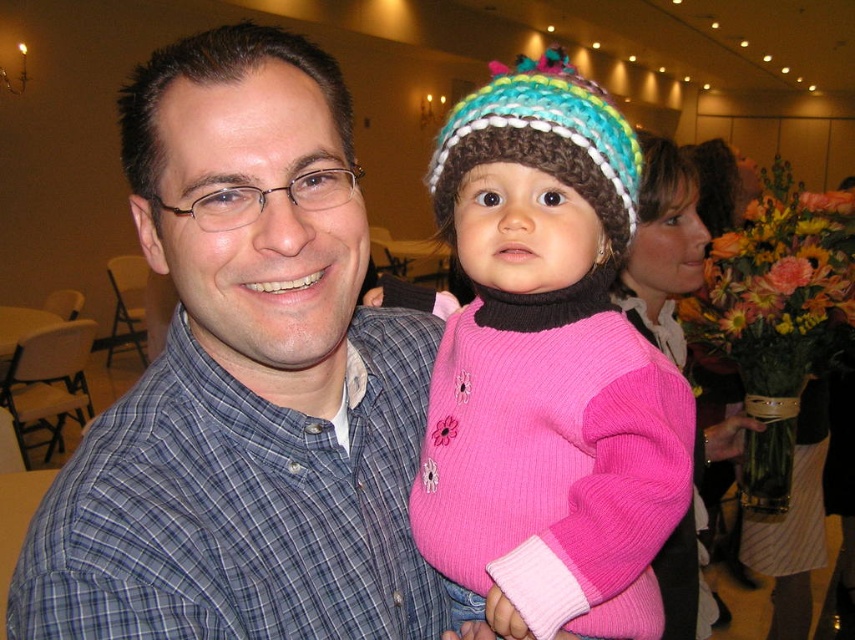
You are a photographer trying to capture a closeup of the blue plaid shirt at center and the knitted pink sweater at center. Which one should you focus on first if you want to ensure both are in focus?

The blue plaid shirt at center is in front of the knitted pink sweater at center, so you should focus on the blue plaid shirt at center first to ensure both are in focus.

You are a photographer at the event and want to capture a closeup of the child wearing both the knitted pink sweater at center and the crochet knit hat at center. Since you can only focus on one item at a time, which item should you choose to ensure the other item remains in the background but still visible?

The knitted pink sweater at center is larger in size than the crochet knit hat at center, so focusing on the sweater would allow the smaller hat to remain in the background while still being visible.